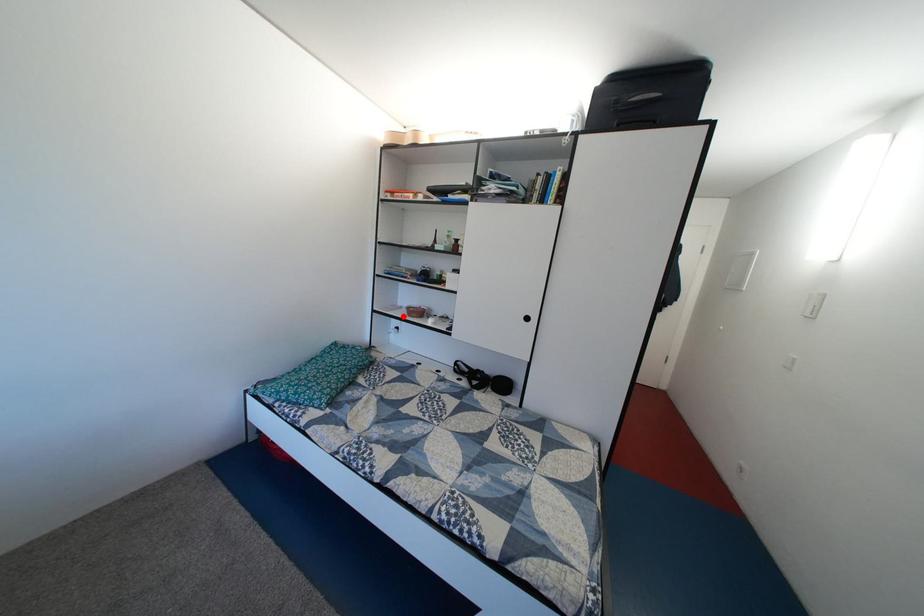
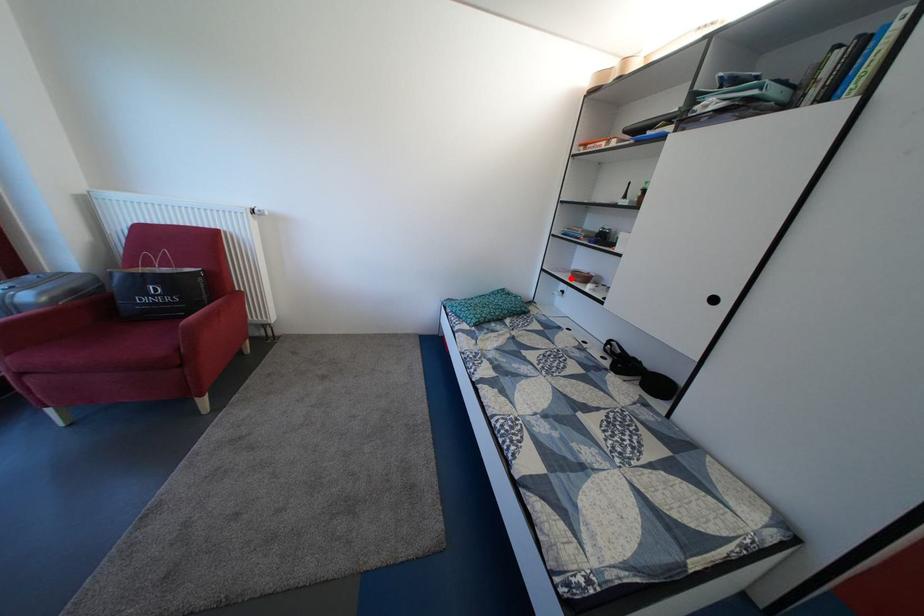
I am providing you with two images of the same scene from different viewpoints. A red point is marked on the first image and another point is marked on the second image. Is the red point in image1 aligned with the point shown in image2?

Yes